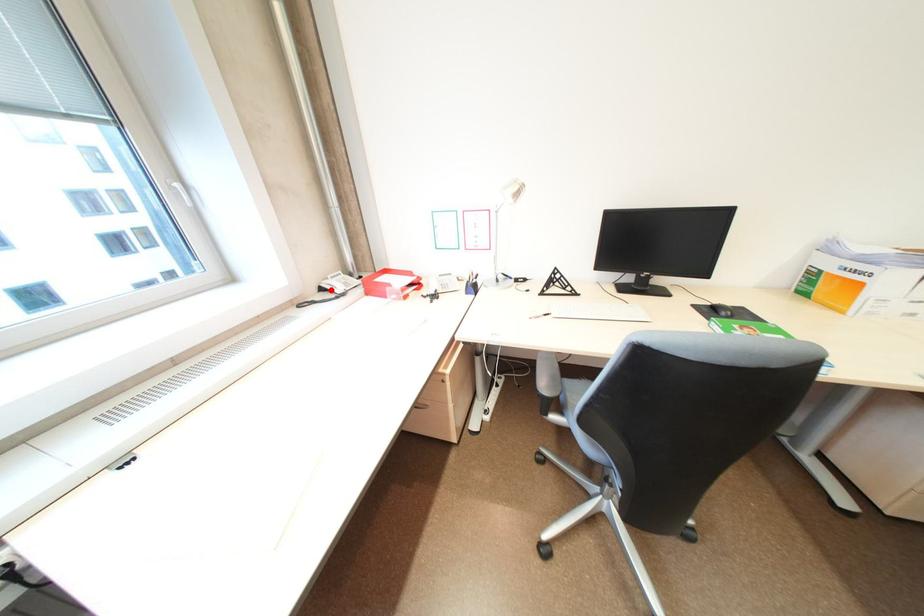
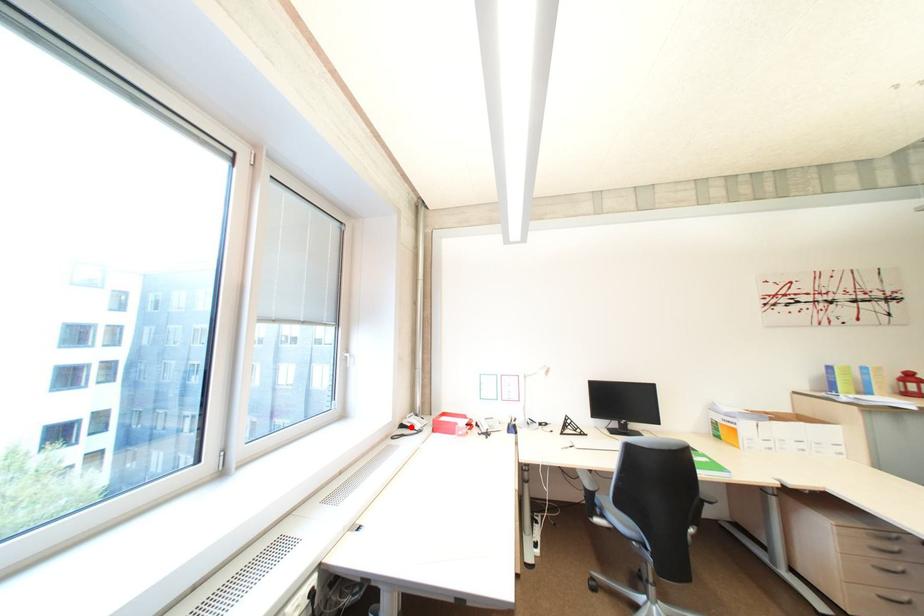
I am providing you with two images of the same scene from different viewpoints. A red point is marked on the first image and another point is marked on the second image. Do the highlighted points in image1 and image2 indicate the same real-world spot?

Yes